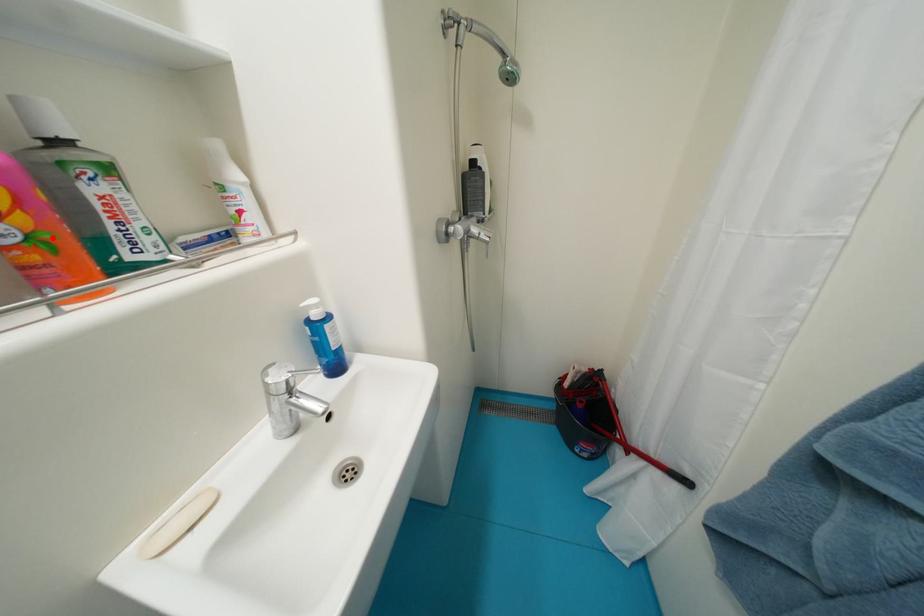
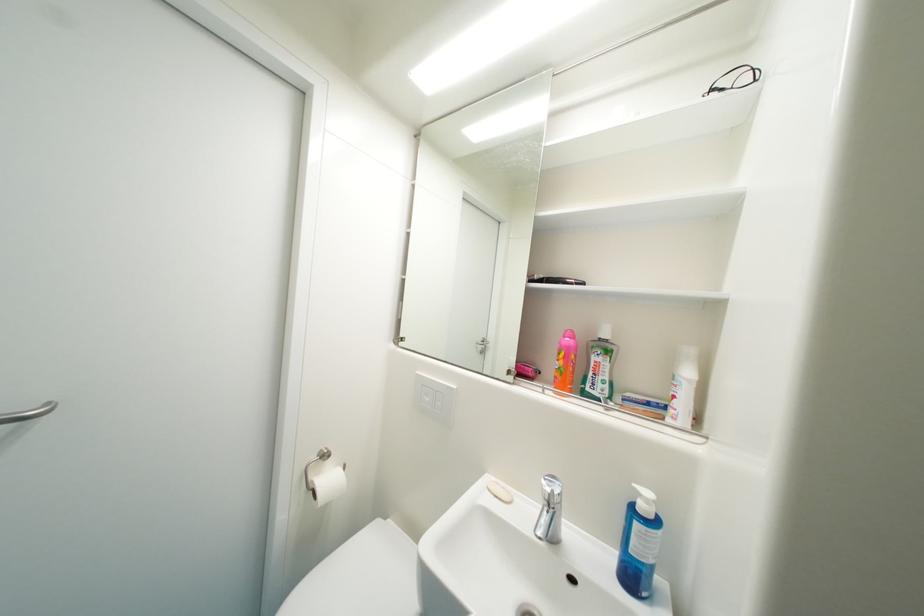
Find the pixel in the second image that matches the highlighted location in the first image.

(569, 371)